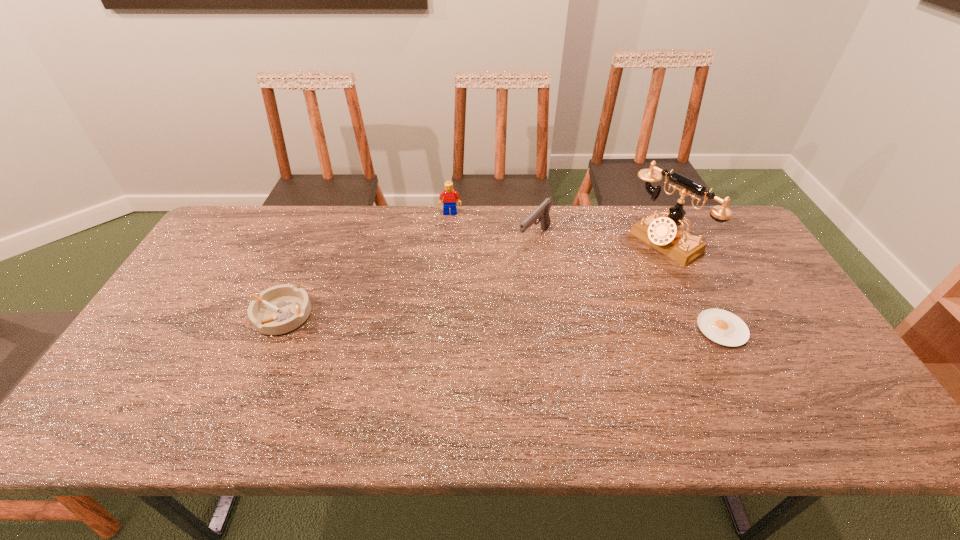
Where is `vacant area that lies between the farthest object and the leftmost object`? vacant area that lies between the farthest object and the leftmost object is located at coordinates pyautogui.click(x=366, y=264).

Identify the location of free spot between the telephone and the egg yolk. This screenshot has height=540, width=960. (693, 285).

You are a GUI agent. You are given a task and a screenshot of the screen. Output one action in this format:
    pyautogui.click(x=<x>, y=<y>)
    Task: Click on the free area in between the telephone and the pistol
    
    Given the screenshot: What is the action you would take?
    pyautogui.click(x=600, y=240)

Where is `vacant area that lies between the third object from right to left and the second shortest object`? vacant area that lies between the third object from right to left and the second shortest object is located at coordinates (408, 276).

At what (x,y) coordinates should I click in order to perform the action: click on vacant space in between the shortest object and the tallest object. Please return your answer as a coordinate pair (x, y). Looking at the image, I should click on (693, 285).

Locate an element on the screen. free space between the third object from right to left and the shortest object is located at coordinates click(628, 284).

Find the location of a particular element. The width and height of the screenshot is (960, 540). object that ranks as the second closest to the ashtray is located at coordinates (542, 212).

Where is `the second closest object to the egg yolk`? The width and height of the screenshot is (960, 540). the second closest object to the egg yolk is located at coordinates (542, 212).

This screenshot has width=960, height=540. Identify the location of vacant space that satisfies the following two spatial constraints: 1. on the back side of the pistol; 2. on the right side of the fourth tallest object. (314, 239).

Locate an element on the screen. The width and height of the screenshot is (960, 540). free space that satisfies the following two spatial constraints: 1. on the front side of the shortest object; 2. on the left side of the farthest object is located at coordinates (441, 329).